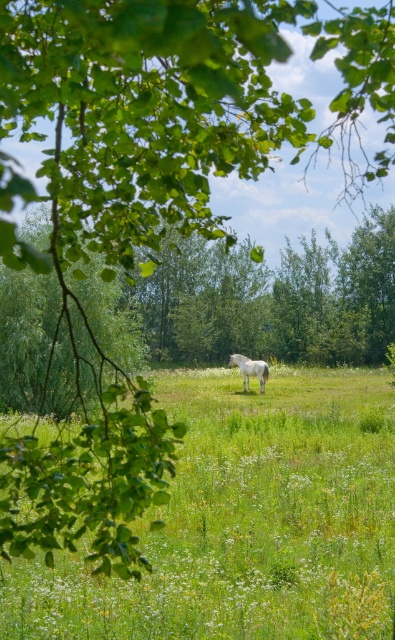
Is point (306, 620) positioned behind point (233, 355)?

No, (306, 620) is closer to viewer.

This screenshot has height=640, width=395. What are the coordinates of `green grassy pasture at center` in the screenshot? It's located at (246, 522).